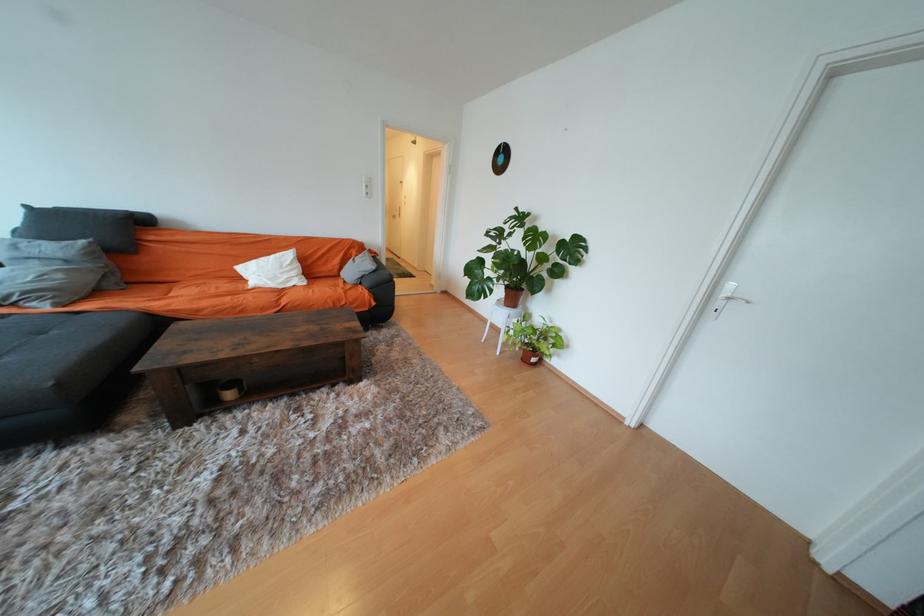
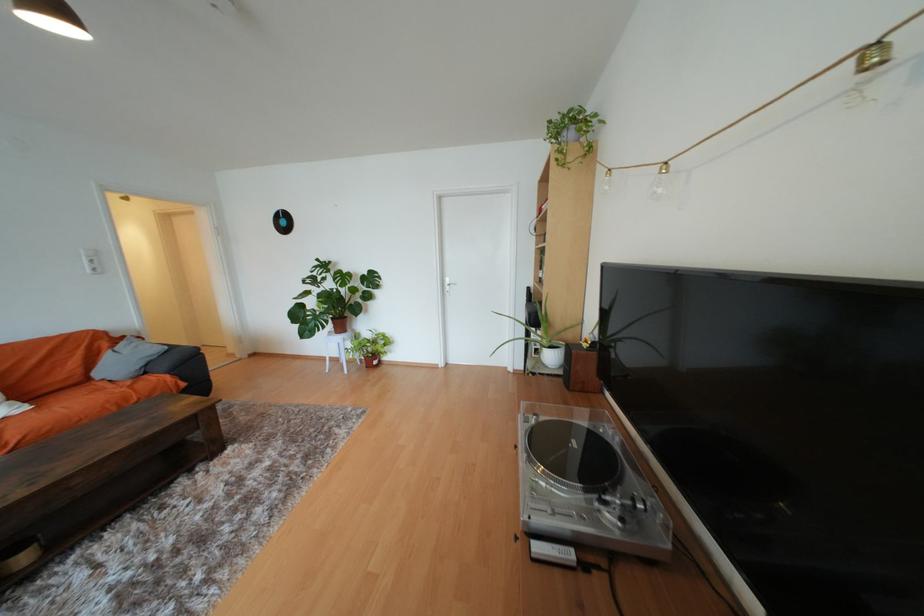
Find the pixel in the second image that matches [564,339] in the first image.

(391, 339)